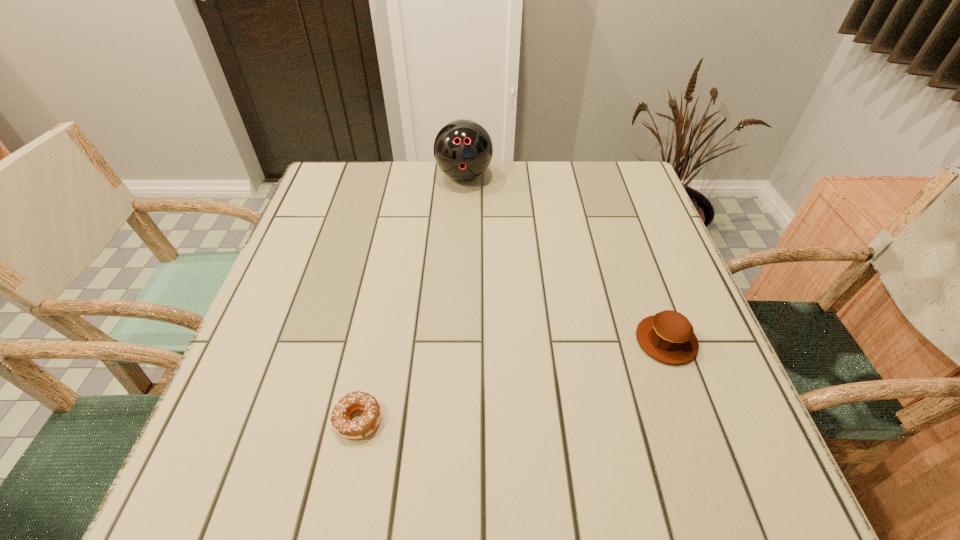
What are the coordinates of `object positioned at the right edge` in the screenshot? It's located at (668, 336).

Where is `vacant space at the far edge`? This screenshot has width=960, height=540. vacant space at the far edge is located at coordinates (433, 209).

Image resolution: width=960 pixels, height=540 pixels. In the image, there is a desktop. What are the coordinates of `vacant space at the left edge` in the screenshot? It's located at (359, 211).

You are a GUI agent. You are given a task and a screenshot of the screen. Output one action in this format:
    pyautogui.click(x=<x>, y=<y>)
    Task: Click on the vacant space at the right edge of the desktop
    The image size is (960, 540).
    Given the screenshot: What is the action you would take?
    pyautogui.click(x=627, y=339)

In the image, there is a desktop. What are the coordinates of `vacant space at the far left corner` in the screenshot? It's located at (367, 184).

Identify the location of free spot at the near left corner of the desktop. The image size is (960, 540). (227, 477).

The width and height of the screenshot is (960, 540). Find the location of `empty space between the tallest object and the shortest object`. empty space between the tallest object and the shortest object is located at coordinates (411, 298).

Locate an element on the screen. The image size is (960, 540). vacant point located between the nearest object and the farthest object is located at coordinates (411, 298).

This screenshot has height=540, width=960. I want to click on vacant point located between the muffin and the tallest object, so click(565, 258).

Locate an element on the screen. free space between the muffin and the leftmost object is located at coordinates (513, 380).